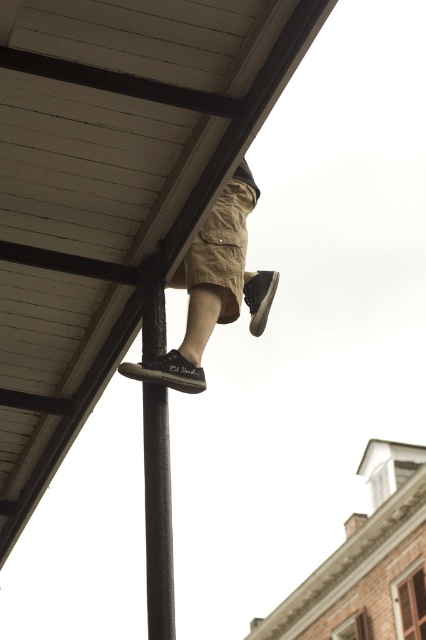
This screenshot has width=426, height=640. Describe the element at coordinates (213, 288) in the screenshot. I see `khaki cotton shorts at center` at that location.

Looking at this image, is khaki cotton shorts at center taller than brown suede shoe at lower center?

Yes.

Between point (192, 380) and point (258, 326), which one is positioned in front?

Positioned in front is point (192, 380).

Find the location of a particular element. The image size is (426, 640). khaki cotton shorts at center is located at coordinates (213, 288).

Between black matte pole at center and black canvas shoe at lower center, which one has less height?

black canvas shoe at lower center is shorter.

Identify the location of black matte pole at center. The width and height of the screenshot is (426, 640). (158, 513).

Between black canvas shoe at lower center and brown suede shoe at lower center, which one has more height?

With more height is brown suede shoe at lower center.

Can you confirm if black canvas shoe at lower center is wider than brown suede shoe at lower center?

Indeed, black canvas shoe at lower center has a greater width compared to brown suede shoe at lower center.

In order to click on black canvas shoe at lower center in this screenshot , I will do `click(167, 372)`.